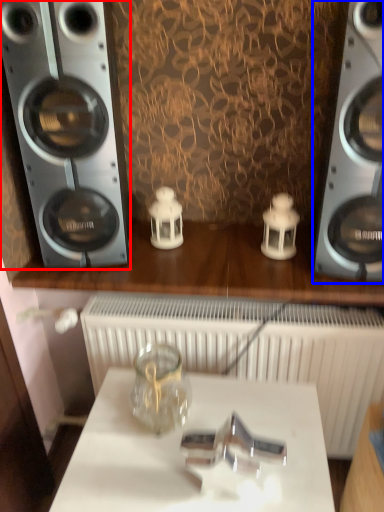
Question: Which of the following is the closest to the observer, home appliance (highlighted by a red box) or home appliance (highlighted by a blue box)?

Choices:
 (A) home appliance
 (B) home appliance

Answer: (B)